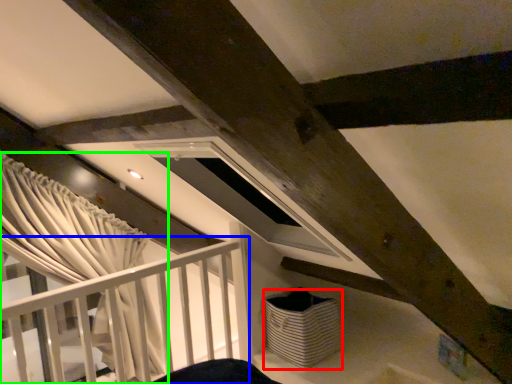
Question: Estimate the real-world distances between objects in this image. Which object is closer to basket (highlighted by a red box), rail (highlighted by a blue box) or curtain (highlighted by a green box)?

Choices:
 (A) rail
 (B) curtain

Answer: (A)